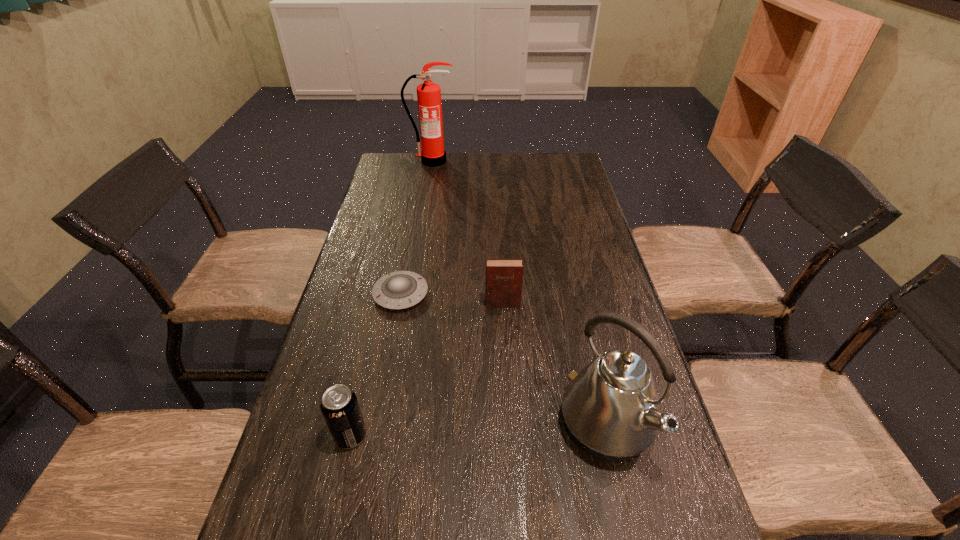
Identify the location of vacant region located 0.390m on the back of the soda can. The height and width of the screenshot is (540, 960). (384, 292).

Identify the location of free spot located on the right of the saucer. [479, 294].

Find the location of a particular element. The width and height of the screenshot is (960, 540). object located in the far edge section of the desktop is located at coordinates (433, 154).

Locate an element on the screen. fire extinguisher at the left edge is located at coordinates (433, 154).

Where is `soda can that is at the left edge`? soda can that is at the left edge is located at coordinates (340, 408).

Find the location of a particular element. The image size is (960, 540). saucer that is at the left edge is located at coordinates (397, 290).

At what (x,y) coordinates should I click in order to perform the action: click on object that is at the right edge. Please return your answer as a coordinate pair (x, y). This screenshot has height=540, width=960. Looking at the image, I should click on (611, 409).

Image resolution: width=960 pixels, height=540 pixels. I want to click on object at the far left corner, so click(433, 154).

Locate an element on the screen. This screenshot has width=960, height=540. vacant space at the far edge of the desktop is located at coordinates (498, 156).

Locate an element on the screen. The width and height of the screenshot is (960, 540). vacant area at the left edge is located at coordinates (300, 523).